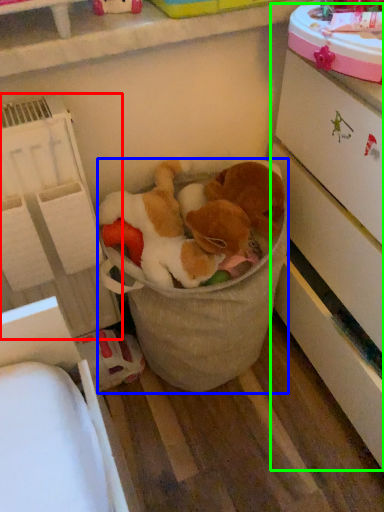
Question: Which object is the farthest from shelf (highlighted by a red box)? Choose among these: toy (highlighted by a blue box) or cabinetry (highlighted by a green box).

Choices:
 (A) toy
 (B) cabinetry

Answer: (B)